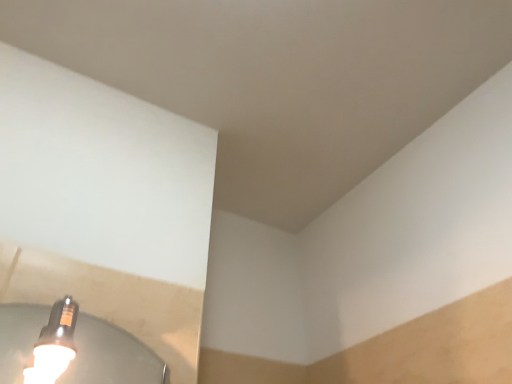
What is the approximate width of white glossy bulb at lower left?

It is 5.24 inches.

This screenshot has height=384, width=512. What do you see at coordinates (54, 344) in the screenshot?
I see `white glossy bulb at lower left` at bounding box center [54, 344].

The image size is (512, 384). In order to click on white glossy bulb at lower left in this screenshot , I will do `click(54, 344)`.

Measure the distance between point (62, 336) and camera.

They are 25.08 inches apart.

The width and height of the screenshot is (512, 384). I want to click on white glossy bulb at lower left, so click(x=54, y=344).